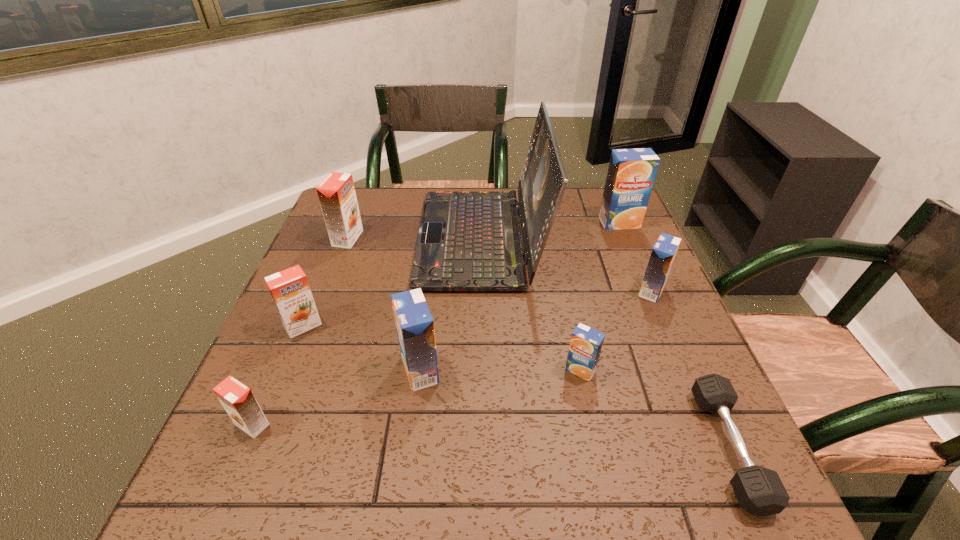
Find the location of a particular element. The image size is (960, 540). free location located on the right of the fourth orange juice from right to left is located at coordinates (584, 370).

The width and height of the screenshot is (960, 540). What are the coordinates of `free region located 0.080m on the left of the second farthest blue orange_juice` in the screenshot? It's located at (603, 291).

The height and width of the screenshot is (540, 960). Find the location of `free space located 0.390m on the back of the second biggest orange orange juice`. free space located 0.390m on the back of the second biggest orange orange juice is located at coordinates (347, 219).

Where is `free region located 0.140m on the right of the third orange juice from right to left`? This screenshot has height=540, width=960. free region located 0.140m on the right of the third orange juice from right to left is located at coordinates (665, 370).

The width and height of the screenshot is (960, 540). In order to click on vacant space located on the front of the nearest orange orange juice in this screenshot , I will do `click(234, 467)`.

Where is `free region located on the back of the shortest object`? free region located on the back of the shortest object is located at coordinates (645, 261).

Locate an element on the screen. Image resolution: width=960 pixels, height=540 pixels. laptop computer that is at the far edge is located at coordinates (468, 241).

Find the location of a particular element. The image size is (960, 540). object that is positioned at the near edge is located at coordinates (760, 491).

Image resolution: width=960 pixels, height=540 pixels. I want to click on dumbbell positioned at the right edge, so click(760, 491).

Image resolution: width=960 pixels, height=540 pixels. Identify the location of object at the far left corner. (337, 196).